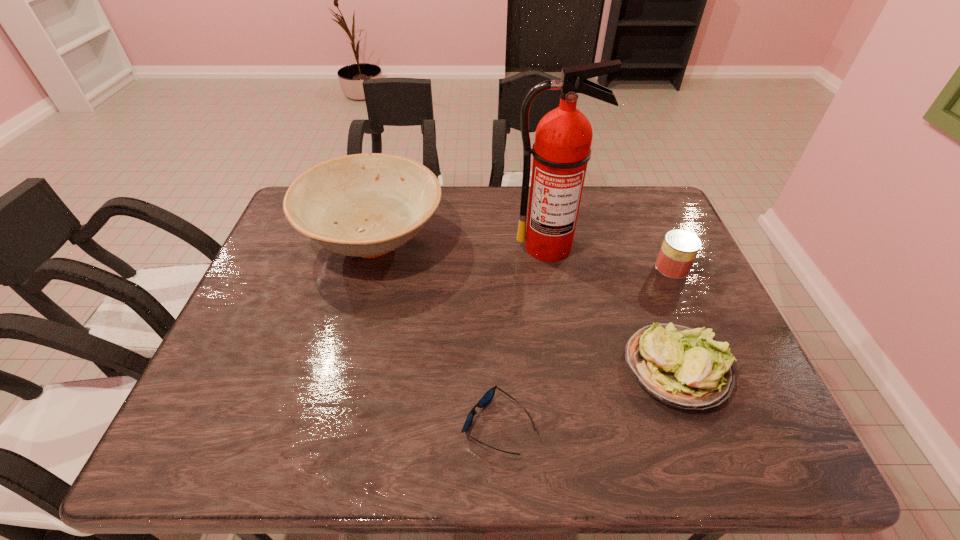
You are a GUI agent. You are given a task and a screenshot of the screen. Output one action in this format:
    pyautogui.click(x=<x>, y=<y>)
    Task: Click on the vacant space that's between the lettuce and the shortest object
    The image size is (960, 540).
    Given the screenshot: What is the action you would take?
    pyautogui.click(x=587, y=396)

The width and height of the screenshot is (960, 540). What are the coordinates of `free space between the fourth tallest object and the can` in the screenshot? It's located at (674, 318).

Locate an element on the screen. vacant space that's between the tallest object and the leftmost object is located at coordinates (462, 244).

In order to click on vacant area that lies between the can and the tallest object in this screenshot , I will do `click(611, 257)`.

You are a GUI agent. You are given a task and a screenshot of the screen. Output one action in this format:
    pyautogui.click(x=<x>, y=<y>)
    Task: Click on the object that is the fourth closest to the sunglasses
    The image size is (960, 540).
    Given the screenshot: What is the action you would take?
    pyautogui.click(x=679, y=249)

Locate which object ranks second in proximity to the shortest object. Please provide its 2D coordinates. Your answer should be formatted as a tuple, i.e. [(x, y)], where the tuple contains the x and y coordinates of a point satisfying the conditions above.

[(365, 205)]

Where is `free space that satisfies the following two spatial constraints: 1. on the back side of the lettuce; 2. on the left side of the can`? The image size is (960, 540). free space that satisfies the following two spatial constraints: 1. on the back side of the lettuce; 2. on the left side of the can is located at coordinates (639, 267).

Find the location of `free location that satisfies the following two spatial constraints: 1. on the side of the tallest object near the handle; 2. at the front of the sunglasses showing the lenses`. free location that satisfies the following two spatial constraints: 1. on the side of the tallest object near the handle; 2. at the front of the sunglasses showing the lenses is located at coordinates (579, 425).

Image resolution: width=960 pixels, height=540 pixels. I want to click on blank area in the image that satisfies the following two spatial constraints: 1. on the side of the fire extinguisher near the handle; 2. on the left side of the can, so click(552, 267).

Identify the location of vacant space that satisfies the following two spatial constraints: 1. on the side of the tallest object near the handle; 2. at the front of the sunglasses showing the lenses. (579, 425).